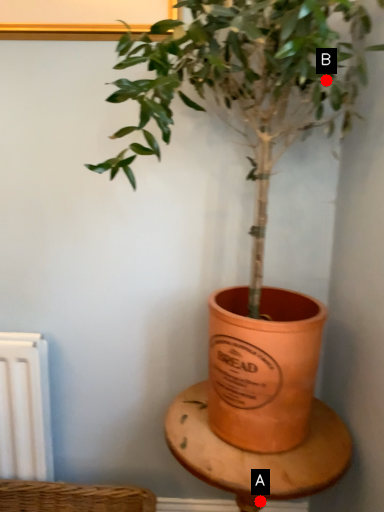
Question: Two points are circled on the image, labeled by A and B beside each circle. Which point appears farthest from the camera in this image?

Choices:
 (A) A is further
 (B) B is further

Answer: (A)